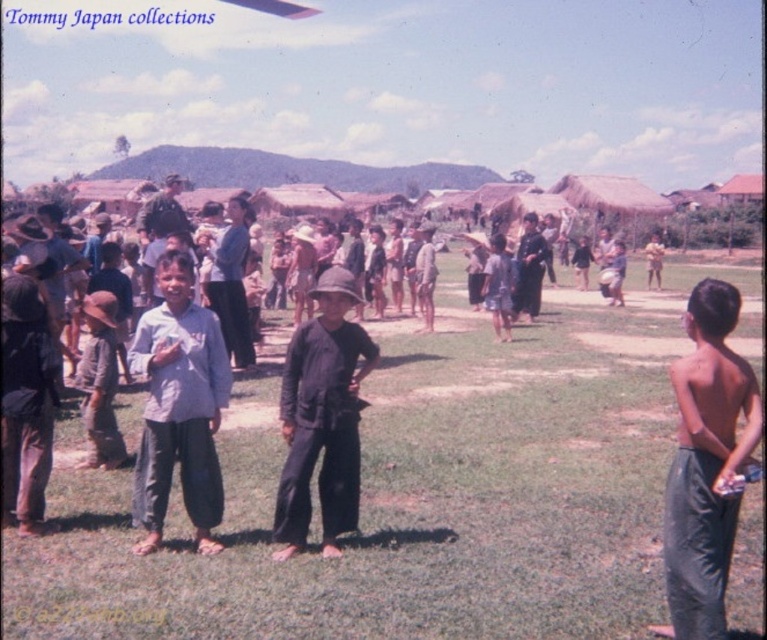
Question: Which point is closer to the camera?

Choices:
 (A) (670, 358)
 (B) (713, 637)
 (C) (193, 477)
 (D) (87, 300)

Answer: (B)

Question: Based on their relative distances, which object is nearer to the light blue shirt at center?

Choices:
 (A) light blue fabric shirt at center
 (B) dark gray fabric hat at center
 (C) green grass at center

Answer: (A)

Question: Can you confirm if green grass at center is bigger than shiny gray pants at right?

Choices:
 (A) yes
 (B) no

Answer: (A)

Question: Is shiny gray pants at right to the right of dark brown leather jacket at center from the viewer's perspective?

Choices:
 (A) no
 (B) yes

Answer: (A)

Question: Which object is positioned closest to the light blue shirt at center?

Choices:
 (A) light blue fabric shirt at center
 (B) brown straw hat at center
 (C) dark gray fabric hat at center
 (D) green grass at center

Answer: (A)

Question: Does green grass at center lie in front of light blue fabric shirt at center?

Choices:
 (A) yes
 (B) no

Answer: (A)